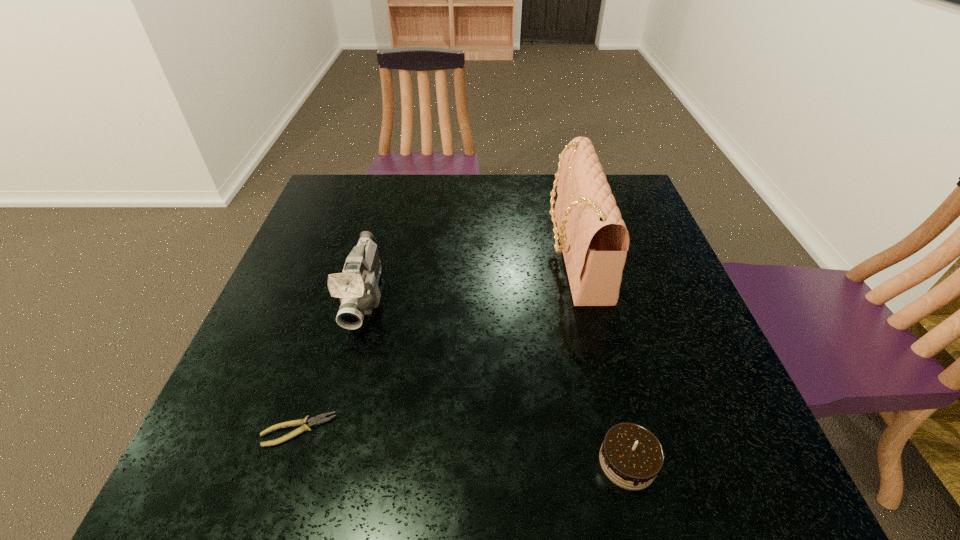
Locate which object is the third closest to the third tallest object. Please provide its 2D coordinates. Your answer should be formatted as a tuple, i.e. [(x, y)], where the tuple contains the x and y coordinates of a point satisfying the conditions above.

[(357, 288)]

Identify which object is the third nearest to the chocolate cake. Please provide its 2D coordinates. Your answer should be formatted as a tuple, i.e. [(x, y)], where the tuple contains the x and y coordinates of a point satisfying the conditions above.

[(357, 288)]

This screenshot has width=960, height=540. I want to click on vacant region that satisfies the following two spatial constraints: 1. on the front-facing side of the tallest object; 2. on the right side of the chocolate cake, so click(x=625, y=462).

I want to click on vacant space that satisfies the following two spatial constraints: 1. on the front-facing side of the handbag; 2. on the back side of the second shortest object, so click(625, 462).

Image resolution: width=960 pixels, height=540 pixels. What are the coordinates of `blank area in the image that satisfies the following two spatial constraints: 1. on the front-facing side of the tallest object; 2. on the front side of the pliers` in the screenshot? It's located at (617, 430).

Find the location of a particular element. The image size is (960, 540). blank space that satisfies the following two spatial constraints: 1. on the front-facing side of the handbag; 2. on the front-facing side of the second tallest object is located at coordinates (585, 297).

Locate an element on the screen. This screenshot has height=540, width=960. vacant space that satisfies the following two spatial constraints: 1. on the front-facing side of the tallest object; 2. on the back side of the chocolate cake is located at coordinates (625, 462).